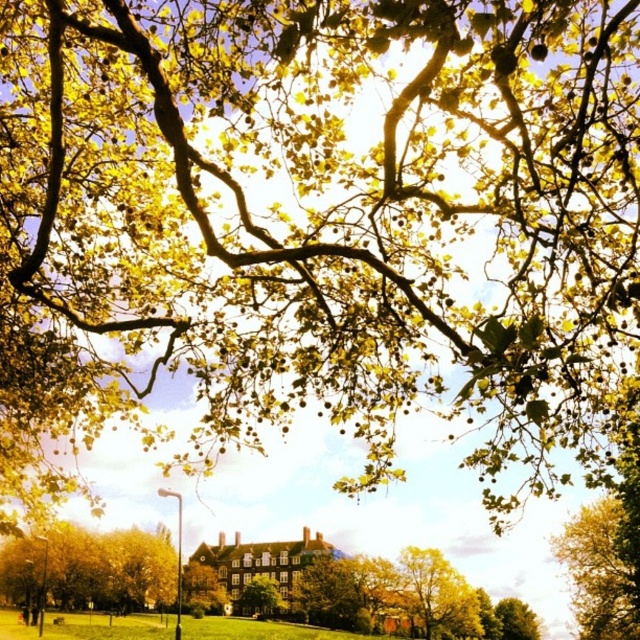
You are standing in the outdoor scene and want to take a photo of the two points marked in the image. Which point, point (12, 563) or point (508, 620), will appear larger in your camera view?

Point (12, 563) will appear larger in the camera view because it is closer to the camera than point (508, 620).